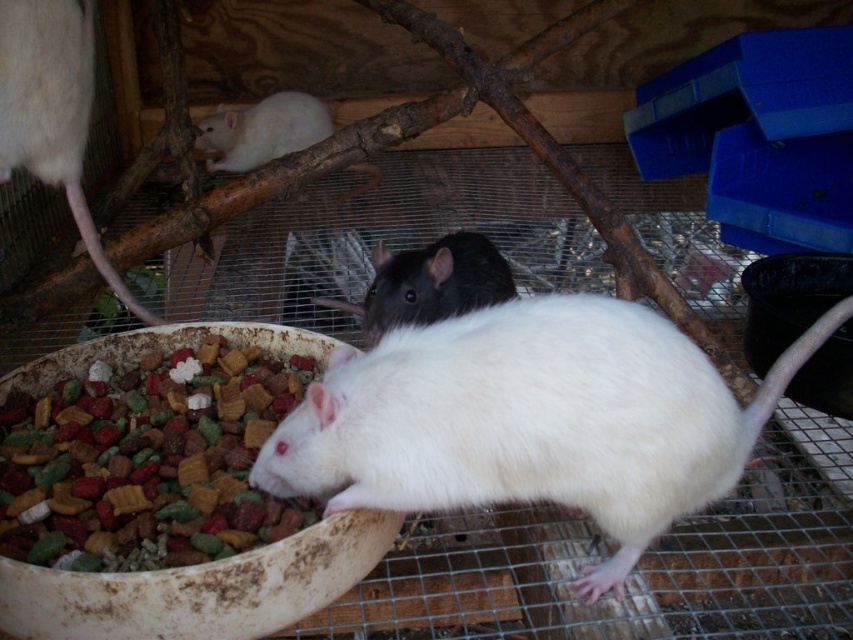
You are a new pet owner who wants to place a toy in the enclosure so that both the white matte fur mouse at center and the shiny black mouse at center can easily access it. Where should you place the toy?

The toy should be placed in front of the shiny black mouse at center, which is behind the white matte fur mouse at center, so that both can easily access it.

Based on the scene description, where is the white matte fur mouse at center located in terms of coordinates?

The white matte fur mouse at center is located at point coordinates of (x=531, y=419).